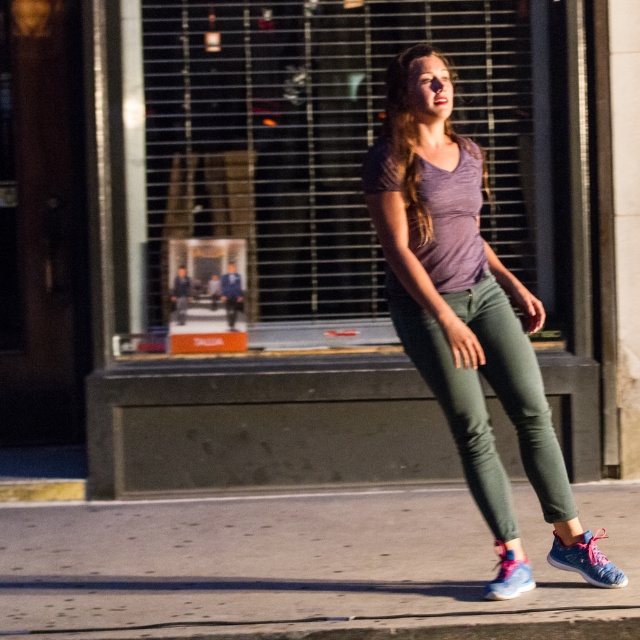
Question: Is matte glass shop window at center wider than blue mesh sneaker at lower right?

Choices:
 (A) no
 (B) yes

Answer: (B)

Question: Which object is the closest to the matte glass shop window at center?

Choices:
 (A) pink mesh sneaker at lower right
 (B) smooth concrete pavement at center
 (C) purple matte shirt at center

Answer: (B)

Question: Does blue mesh sneaker at lower right have a smaller size compared to pink mesh sneaker at lower right?

Choices:
 (A) no
 (B) yes

Answer: (B)

Question: Which point is farther to the camera?

Choices:
 (A) (381, 220)
 (B) (257, 211)

Answer: (B)

Question: Does matte glass shop window at center have a lesser width compared to green denim leggings at center?

Choices:
 (A) yes
 (B) no

Answer: (B)

Question: Among these objects, which one is nearest to the camera?

Choices:
 (A) pink mesh sneaker at lower right
 (B) blue mesh sneaker at lower right

Answer: (A)